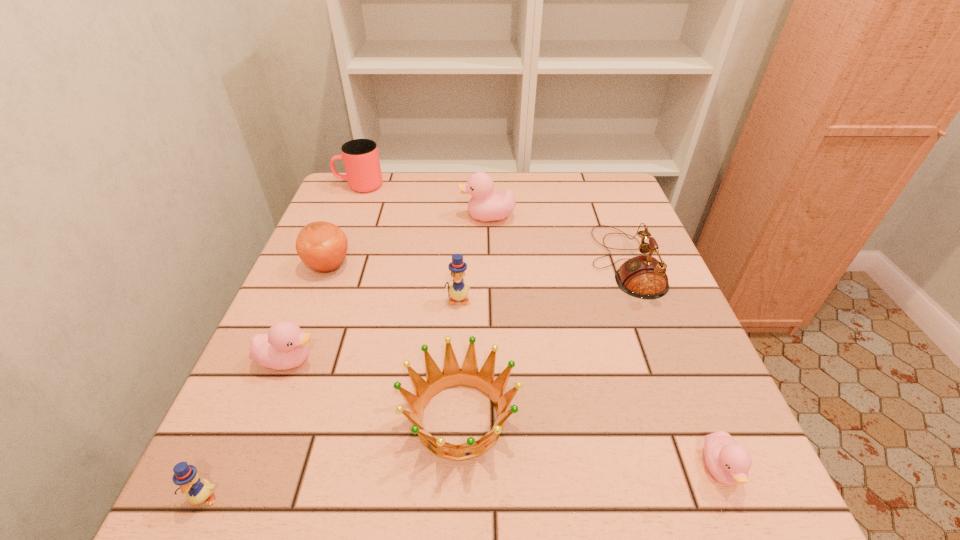
Find the location of a particular element. vacant space located on the rotary dial of the telephone is located at coordinates (545, 262).

You are a GUI agent. You are given a task and a screenshot of the screen. Output one action in this format:
    pyautogui.click(x=<x>, y=<y>)
    Task: Click on the free space located 0.380m on the rotary dial of the telephone
    
    Given the screenshot: What is the action you would take?
    pyautogui.click(x=431, y=262)

You are a GUI agent. You are given a task and a screenshot of the screen. Output one action in this format:
    pyautogui.click(x=<x>, y=<y>)
    Task: Click on the vacant region located on the rotary dial of the telephone
    
    Given the screenshot: What is the action you would take?
    pyautogui.click(x=468, y=262)

Where is `blank area located on the front-facing side of the third nearest duckling`? The width and height of the screenshot is (960, 540). blank area located on the front-facing side of the third nearest duckling is located at coordinates (400, 360).

Where is `free region located 0.160m on the back of the crown`? The width and height of the screenshot is (960, 540). free region located 0.160m on the back of the crown is located at coordinates (464, 307).

Where is `duckling that is at the far edge`? This screenshot has width=960, height=540. duckling that is at the far edge is located at coordinates (484, 206).

The width and height of the screenshot is (960, 540). In order to click on cup located at the far edge in this screenshot , I will do `click(361, 160)`.

Locate an element on the screen. crown that is at the near edge is located at coordinates (468, 375).

This screenshot has height=540, width=960. I want to click on cup that is at the left edge, so click(x=361, y=160).

Where is `orange at the left edge`? The width and height of the screenshot is (960, 540). orange at the left edge is located at coordinates (322, 246).